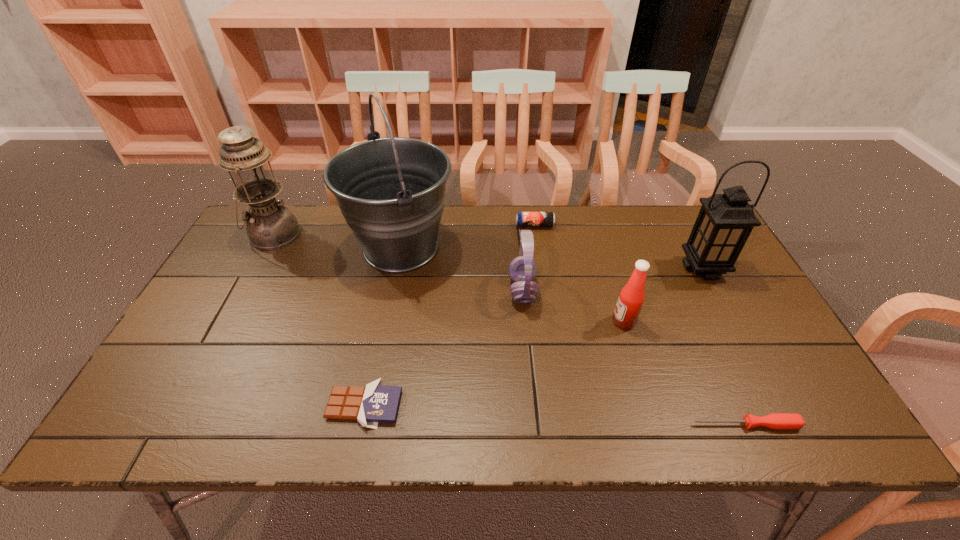
The image size is (960, 540). Identify the location of object located at the far left corner. (270, 225).

The height and width of the screenshot is (540, 960). In order to click on object at the near right corner in this screenshot , I will do `click(782, 421)`.

This screenshot has width=960, height=540. In the image, there is a desktop. Find the location of `vacant space at the far edge`. vacant space at the far edge is located at coordinates (519, 232).

This screenshot has width=960, height=540. Identify the location of free space at the near edge. (737, 411).

Find the location of a particular element. Image resolution: width=960 pixels, height=540 pixels. free region at the left edge of the desktop is located at coordinates (240, 329).

You are a GUI agent. You are given a task and a screenshot of the screen. Output one action in this format:
    pyautogui.click(x=<x>, y=<y>)
    Task: Click on the free space at the right edge
    
    Given the screenshot: What is the action you would take?
    pyautogui.click(x=744, y=357)

I want to click on vacant area at the far left corner, so click(298, 219).

In the image, there is a desktop. Find the location of `vacant space at the near left corner`. vacant space at the near left corner is located at coordinates (200, 418).

In the image, there is a desktop. Where is `vacant space at the far right corner`? vacant space at the far right corner is located at coordinates (669, 214).

Identify the location of free space that is in between the screwdriver and the lantern. coord(724,346).